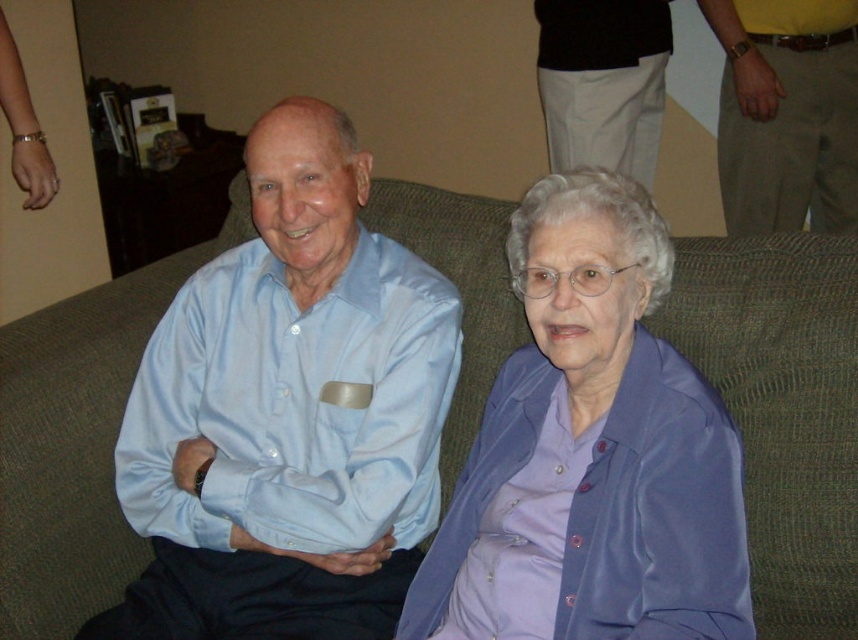
Based on the photo, you are a photographer setting up for a group photo. You need to ensure that the light blue satin shirt at center and the green fabric couch at center are both visible in the frame. Given their sizes, which object will require more space in the composition?

The light blue satin shirt at center has a smaller size compared to the green fabric couch at center, so the green fabric couch at center will require more space in the composition.